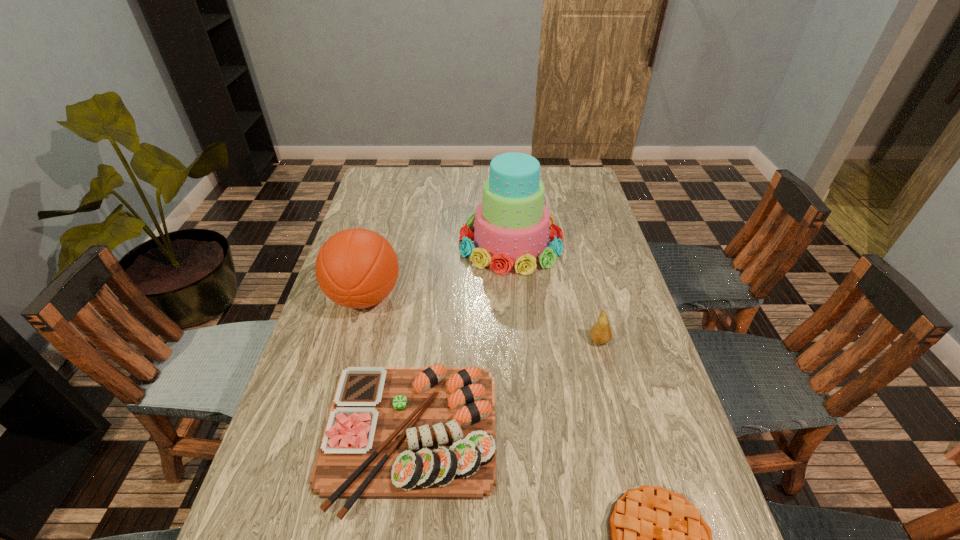
What are the coordinates of `cake` in the screenshot? It's located at (511, 225).

Identify the location of basketball. (357, 268).

Identify the location of the third nearest object. (601, 333).

At what (x,y) coordinates should I click in order to perform the action: click on pear. Please return your answer as a coordinate pair (x, y). Image resolution: width=960 pixels, height=540 pixels. Looking at the image, I should click on (601, 333).

Where is `the fourth tallest object`? The image size is (960, 540). the fourth tallest object is located at coordinates (392, 432).

Where is `free space located 0.050m on the back of the tallest object`? free space located 0.050m on the back of the tallest object is located at coordinates (508, 208).

What are the coordinates of `vacant point located on the right of the second tallest object` in the screenshot? It's located at (507, 297).

Where is `free space located 0.070m on the left of the third nearest object`? This screenshot has width=960, height=540. free space located 0.070m on the left of the third nearest object is located at coordinates (563, 340).

This screenshot has height=540, width=960. What are the coordinates of `vacant region located 0.120m on the back of the fourth tallest object` in the screenshot? It's located at (425, 334).

The image size is (960, 540). Identify the location of basketball at the left edge. (357, 268).